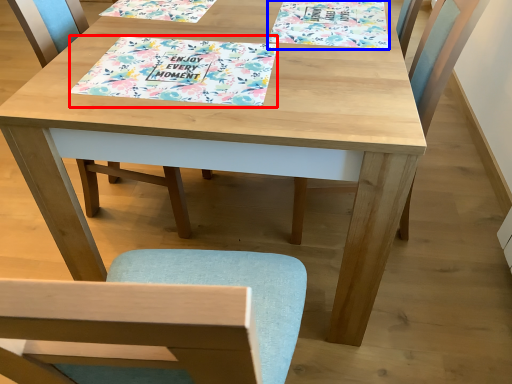
Question: Among these objects, which one is nearest to the camera, tablecloth (highlighted by a red box) or book cover (highlighted by a blue box)?

Choices:
 (A) tablecloth
 (B) book cover

Answer: (A)